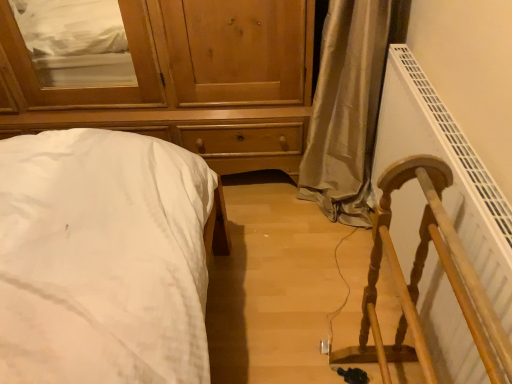
Question: From a real-world perspective, is white cotton bed at left positioned above or below wooden chest of drawers at upper left?

Choices:
 (A) below
 (B) above

Answer: (A)

Question: Looking at their shapes, would you say white cotton bed at left is wider or thinner than wooden chest of drawers at upper left?

Choices:
 (A) wide
 (B) thin

Answer: (A)

Question: Which object is the farthest from the white plastic radiator at right?

Choices:
 (A) wooden chest of drawers at upper left
 (B) white cotton bed at left

Answer: (B)

Question: Estimate the real-world distances between objects in this image. Which object is farther from the white plastic radiator at right?

Choices:
 (A) wooden chest of drawers at upper left
 (B) white cotton bed at left

Answer: (B)